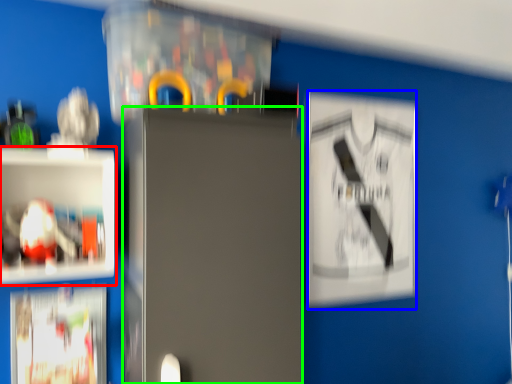
Question: Which is farther away from shelf (highlighted by a red box)? poster (highlighted by a blue box) or fridge (highlighted by a green box)?

Choices:
 (A) poster
 (B) fridge

Answer: (A)